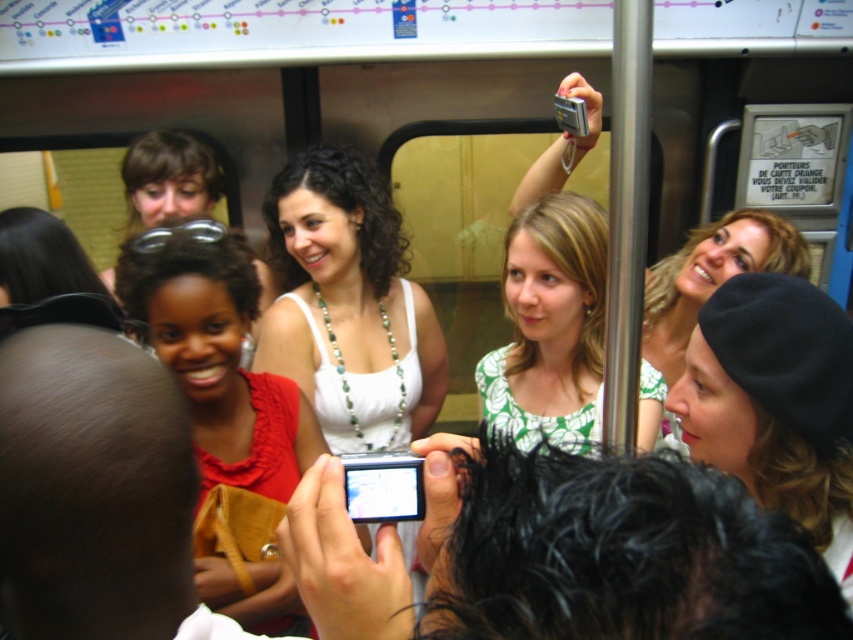
Question: Which of the following is the closest to the observer?

Choices:
 (A) white beaded necklace at center
 (B) matte black beanie at upper right
 (C) green printed blouse at center

Answer: (C)

Question: Which of the following is the closest to the observer?

Choices:
 (A) green printed blouse at center
 (B) matte black beanie at upper right
 (C) white beaded necklace at center
 (D) matte red blouse at center

Answer: (D)

Question: Which object is positioned farthest from the matte red blouse at center?

Choices:
 (A) green printed blouse at center
 (B) white beaded necklace at center

Answer: (A)

Question: From the image, what is the correct spatial relationship of white beaded necklace at center in relation to green printed blouse at center?

Choices:
 (A) left
 (B) right

Answer: (A)

Question: Is matte red blouse at center bigger than green printed blouse at center?

Choices:
 (A) yes
 (B) no

Answer: (A)

Question: Does matte red blouse at center come in front of green printed blouse at center?

Choices:
 (A) yes
 (B) no

Answer: (A)